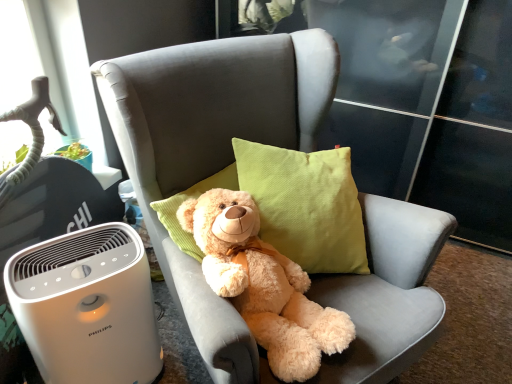
Question: Is white plastic air purifier at lower left closer to the viewer compared to soft gray fabric chair at center?

Choices:
 (A) yes
 (B) no

Answer: (B)

Question: From the image's perspective, is white plastic air purifier at lower left over soft gray fabric chair at center?

Choices:
 (A) yes
 (B) no

Answer: (B)

Question: From the image's perspective, is white plastic air purifier at lower left below soft gray fabric chair at center?

Choices:
 (A) yes
 (B) no

Answer: (A)

Question: Does white plastic air purifier at lower left turn towards soft gray fabric chair at center?

Choices:
 (A) yes
 (B) no

Answer: (B)

Question: Is white plastic air purifier at lower left positioned behind soft gray fabric chair at center?

Choices:
 (A) yes
 (B) no

Answer: (A)

Question: From a real-world perspective, relative to fluffy beige teddy bear at center, is white plastic air purifier at lower left vertically above or below?

Choices:
 (A) above
 (B) below

Answer: (B)

Question: Considering the positions of white plastic air purifier at lower left and fluffy beige teddy bear at center in the image, is white plastic air purifier at lower left bigger or smaller than fluffy beige teddy bear at center?

Choices:
 (A) big
 (B) small

Answer: (A)

Question: Would you say white plastic air purifier at lower left is to the left or to the right of fluffy beige teddy bear at center in the picture?

Choices:
 (A) right
 (B) left

Answer: (B)

Question: From the image's perspective, relative to fluffy beige teddy bear at center, is white plastic air purifier at lower left above or below?

Choices:
 (A) below
 (B) above

Answer: (A)

Question: Considering the positions of point (94, 297) and point (398, 248), is point (94, 297) closer or farther from the camera than point (398, 248)?

Choices:
 (A) closer
 (B) farther

Answer: (A)

Question: In terms of size, does white plastic air purifier at lower left appear bigger or smaller than soft gray fabric chair at center?

Choices:
 (A) small
 (B) big

Answer: (A)

Question: In the image, is white plastic air purifier at lower left positioned in front of or behind soft gray fabric chair at center?

Choices:
 (A) behind
 (B) front

Answer: (A)

Question: Considering the positions of white plastic air purifier at lower left and soft gray fabric chair at center in the image, is white plastic air purifier at lower left taller or shorter than soft gray fabric chair at center?

Choices:
 (A) tall
 (B) short

Answer: (B)

Question: Is point (218, 150) closer or farther from the camera than point (263, 329)?

Choices:
 (A) closer
 (B) farther

Answer: (B)

Question: In terms of size, does soft gray fabric chair at center appear bigger or smaller than fluffy beige teddy bear at center?

Choices:
 (A) small
 (B) big

Answer: (B)